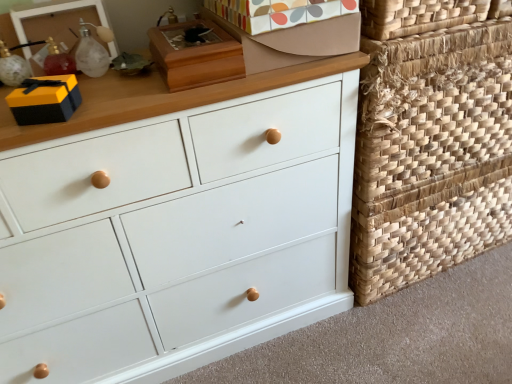
Question: Does translucent glass bottle at upper left have a smaller size compared to white matte chest of drawers at center?

Choices:
 (A) no
 (B) yes

Answer: (B)

Question: Can you confirm if translucent glass bottle at upper left is taller than white matte chest of drawers at center?

Choices:
 (A) no
 (B) yes

Answer: (A)

Question: From a real-world perspective, does translucent glass bottle at upper left stand above white matte chest of drawers at center?

Choices:
 (A) yes
 (B) no

Answer: (A)

Question: Does translucent glass bottle at upper left have a lesser height compared to white matte chest of drawers at center?

Choices:
 (A) no
 (B) yes

Answer: (B)

Question: From a real-world perspective, does translucent glass bottle at upper left sit lower than white matte chest of drawers at center?

Choices:
 (A) no
 (B) yes

Answer: (A)

Question: From a real-world perspective, is natural woven basket at right, positioned as the 1th basket in top-to-bottom order, above or below patterned cardboard shoe box at upper center, which ranks as the second shoe box in left-to-right order?

Choices:
 (A) below
 (B) above

Answer: (A)

Question: Is natural woven basket at right, positioned as the 1th basket in top-to-bottom order, wider or thinner than patterned cardboard shoe box at upper center, which ranks as the second shoe box in left-to-right order?

Choices:
 (A) wide
 (B) thin

Answer: (A)

Question: From the image's perspective, relative to patterned cardboard shoe box at upper center, which ranks as the second shoe box in left-to-right order, is natural woven basket at right, positioned as the 2th basket in bottom-to-top order, above or below?

Choices:
 (A) below
 (B) above

Answer: (A)

Question: In terms of size, does natural woven basket at right, positioned as the 1th basket in top-to-bottom order, appear bigger or smaller than patterned cardboard shoe box at upper center, which ranks as the second shoe box in left-to-right order?

Choices:
 (A) small
 (B) big

Answer: (B)

Question: From a real-world perspective, relative to matte black gift box at upper left, is patterned cardboard shoe box at upper center, which is the first shoe box from right to left, vertically above or below?

Choices:
 (A) below
 (B) above

Answer: (A)

Question: Is patterned cardboard shoe box at upper center, which is the first shoe box from right to left, taller or shorter than matte black gift box at upper left?

Choices:
 (A) tall
 (B) short

Answer: (A)

Question: In terms of size, does patterned cardboard shoe box at upper center, which ranks as the second shoe box in left-to-right order, appear bigger or smaller than matte black gift box at upper left?

Choices:
 (A) small
 (B) big

Answer: (B)

Question: In the image, is patterned cardboard shoe box at upper center, which is the first shoe box from right to left, positioned in front of or behind matte black gift box at upper left?

Choices:
 (A) behind
 (B) front

Answer: (A)

Question: From the image's perspective, is translucent glass bottle at upper left located above or below natural woven basket at right, which is the first basket in bottom-to-top order?

Choices:
 (A) above
 (B) below

Answer: (A)

Question: Is translucent glass bottle at upper left taller or shorter than natural woven basket at right, which is the first basket in bottom-to-top order?

Choices:
 (A) short
 (B) tall

Answer: (A)